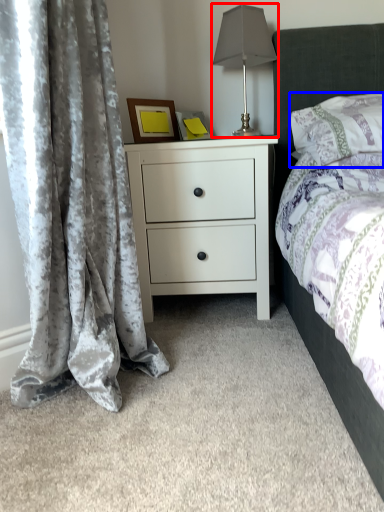
Question: Among these objects, which one is nearest to the camera, table lamp (highlighted by a red box) or pillow (highlighted by a blue box)?

Choices:
 (A) table lamp
 (B) pillow

Answer: (B)